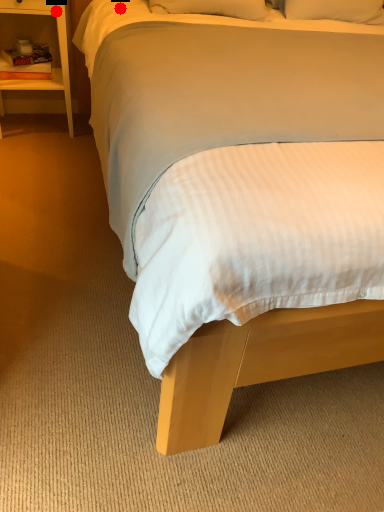
Question: Two points are circled on the image, labeled by A and B beside each circle. Which point is farther to the camera?

Choices:
 (A) A is further
 (B) B is further

Answer: (B)